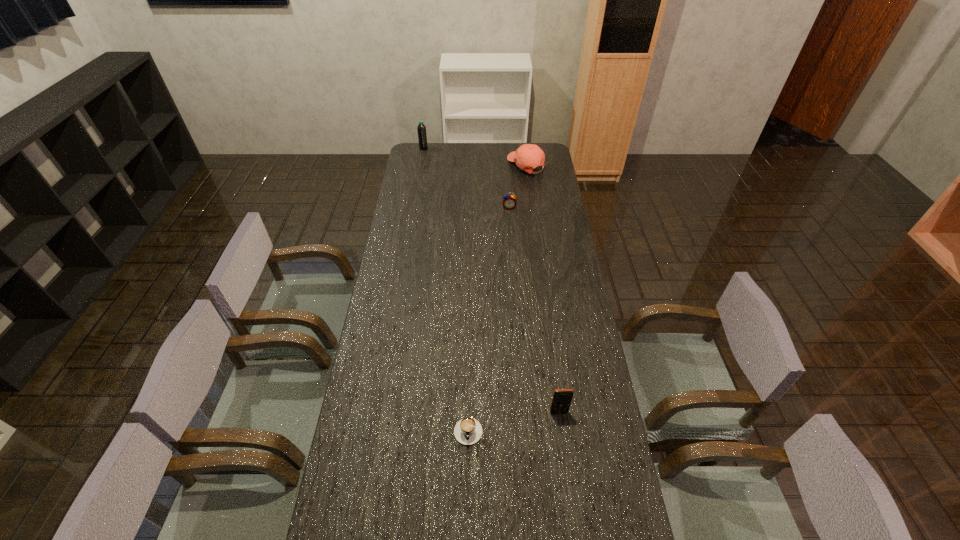
I want to click on the farthest object, so click(x=422, y=136).

At what (x,y) coordinates should I click in order to perform the action: click on water bottle. Please return your answer as a coordinate pair (x, y). This screenshot has width=960, height=540. Looking at the image, I should click on (422, 136).

This screenshot has width=960, height=540. I want to click on baseball cap, so click(528, 156).

At what (x,y) coordinates should I click in order to perform the action: click on cellular telephone. Please return your answer as a coordinate pair (x, y). This screenshot has width=960, height=540. Looking at the image, I should click on (562, 398).

Image resolution: width=960 pixels, height=540 pixels. What are the coordinates of `alarm clock` in the screenshot? It's located at (509, 201).

You are a GUI agent. You are given a task and a screenshot of the screen. Output one action in this format:
    pyautogui.click(x=<x>, y=<y>)
    Task: Click on the fourth tallest object
    The width and height of the screenshot is (960, 540).
    Given the screenshot: What is the action you would take?
    pyautogui.click(x=509, y=201)

Identify the location of the fourth object from right to left. This screenshot has width=960, height=540. (467, 431).

You are a GUI agent. You are given a task and a screenshot of the screen. Output one action in this format:
    pyautogui.click(x=<x>, y=<y>)
    Task: Click on the shortest object
    The image size is (960, 540).
    Given the screenshot: What is the action you would take?
    pyautogui.click(x=467, y=431)

Where is `vacant space located 0.380m on the front of the leftmost object`? The image size is (960, 540). vacant space located 0.380m on the front of the leftmost object is located at coordinates (417, 191).

You are a GUI agent. You are given a task and a screenshot of the screen. Output one action in this format:
    pyautogui.click(x=<x>, y=<y>)
    Task: Click on the vacant position located 0.090m on the back of the baseball cap
    
    Given the screenshot: What is the action you would take?
    pyautogui.click(x=524, y=145)